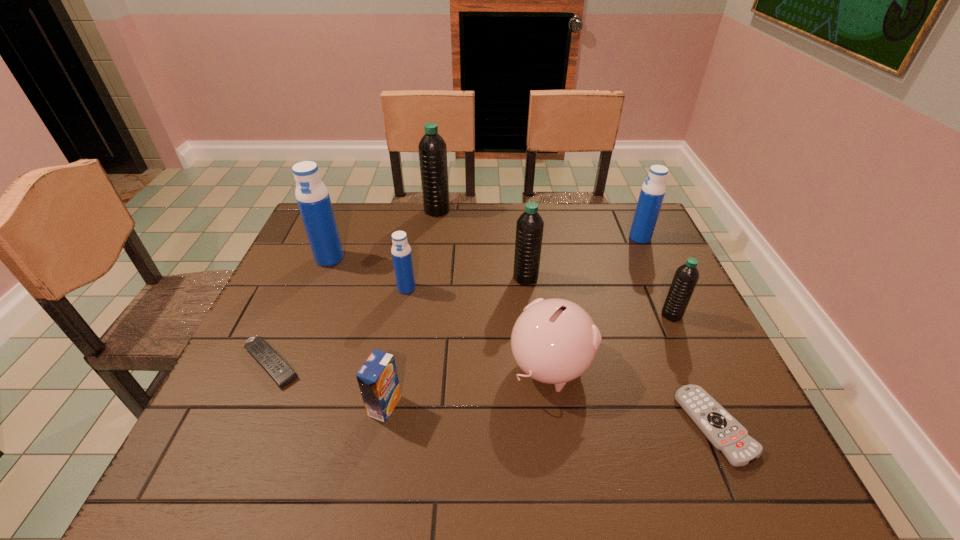
Where is `the nearest blue water bottle`? This screenshot has width=960, height=540. the nearest blue water bottle is located at coordinates (401, 252).

Locate an element on the screen. This screenshot has width=960, height=540. the second blue water bottle from right to left is located at coordinates (401, 252).

Locate an element on the screen. piggy bank is located at coordinates point(554,341).

Locate an element on the screen. The image size is (960, 540). blue orange_juice is located at coordinates (378, 381).

Where is `orange_juice`? The image size is (960, 540). orange_juice is located at coordinates (378, 381).

The image size is (960, 540). Identify the location of the left remote control. (266, 356).

At what (x,y) coordinates should I click in order to perform the action: click on the right remote control. Please return your answer as a coordinate pair (x, y). Looking at the image, I should click on (724, 432).

I want to click on the shortest object, so click(x=724, y=432).

Find the location of `vacant point located on the front of the farthest black water bottle`. vacant point located on the front of the farthest black water bottle is located at coordinates (432, 246).

Find the location of a particular element. The height and width of the screenshot is (540, 960). free space located on the front of the leftmost blue water bottle is located at coordinates (302, 326).